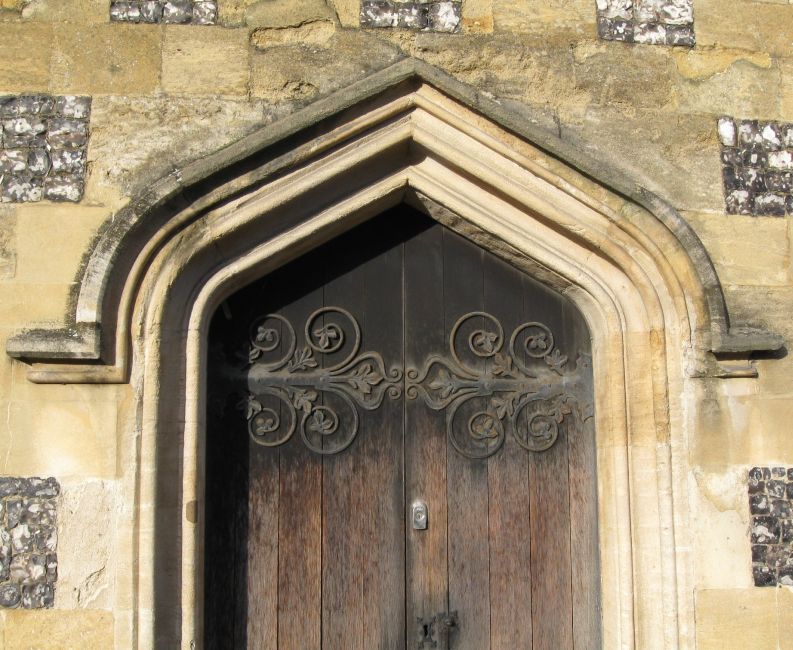
Identify the location of door on the right. (488, 483).